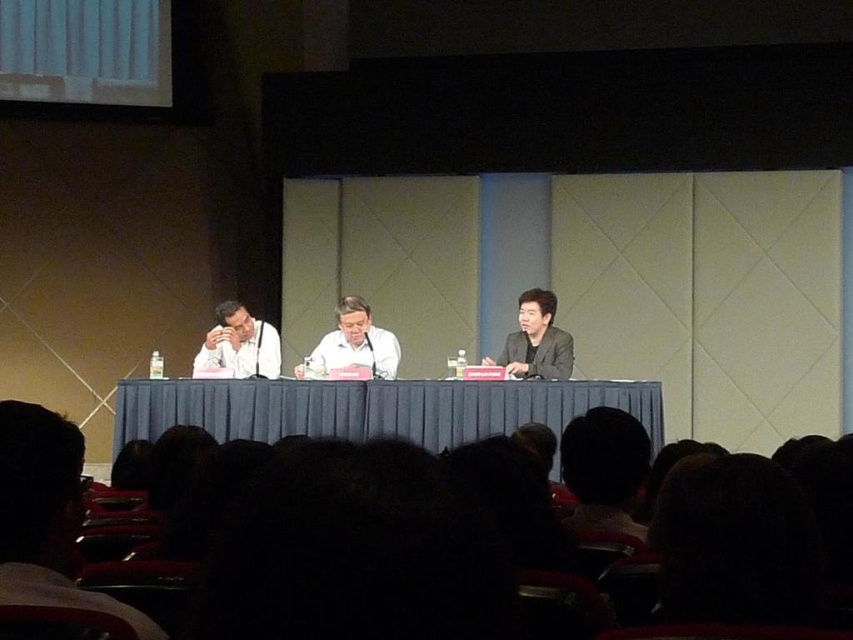
Question: Can you confirm if blue fabric table at center is thinner than matte white shirt at left?

Choices:
 (A) no
 (B) yes

Answer: (A)

Question: Considering the relative positions of blue fabric table at center and dark hair at lower left in the image provided, where is blue fabric table at center located with respect to dark hair at lower left?

Choices:
 (A) below
 (B) above

Answer: (A)

Question: Which object is farther from the camera taking this photo?

Choices:
 (A) matte white shirt at left
 (B) blue fabric table at center
 (C) dark hair at lower left

Answer: (A)

Question: Estimate the real-world distances between objects in this image. Which object is farther from the matte white shirt at left?

Choices:
 (A) blue fabric table at center
 (B) smooth white shirt at center

Answer: (A)

Question: Which object is farther from the camera taking this photo?

Choices:
 (A) smooth white shirt at center
 (B) blue fabric table at center

Answer: (A)

Question: Can you confirm if dark hair at lower left is positioned to the right of smooth white shirt at center?

Choices:
 (A) no
 (B) yes

Answer: (B)